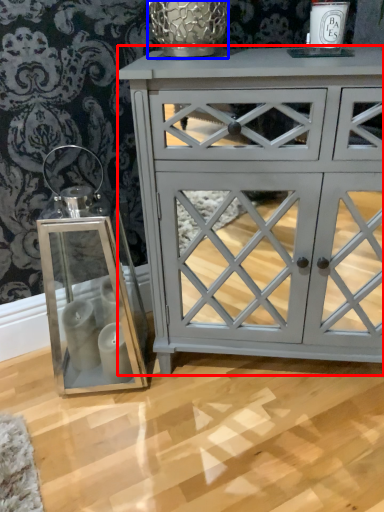
Question: Which of the following is the farthest to the observer, chest of drawers (highlighted by a red box) or glass vase (highlighted by a blue box)?

Choices:
 (A) chest of drawers
 (B) glass vase

Answer: (B)